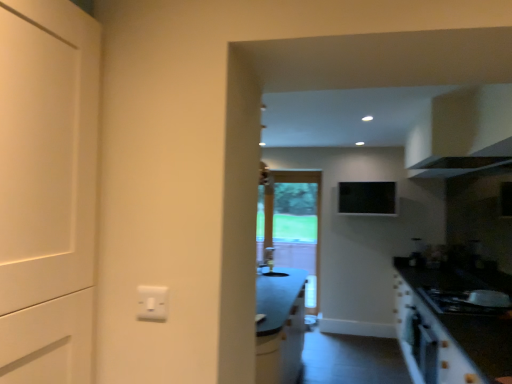
At what (x,y) coordinates should I click in order to perform the action: click on free space above black matte gas stove at lower right (from a real-world perspective). Please return your answer as a coordinate pair (x, y). The width and height of the screenshot is (512, 384). Looking at the image, I should click on (470, 297).